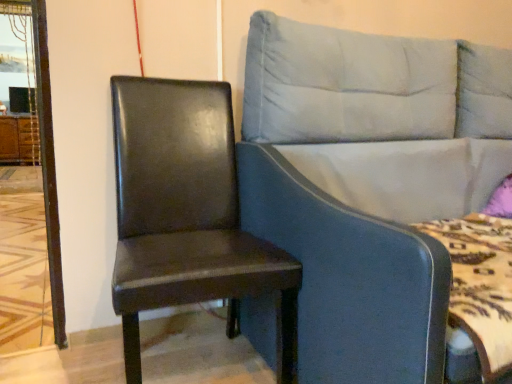
Question: Is brown wood dresser at left placed right next to light blue fabric studio couch at center?

Choices:
 (A) no
 (B) yes

Answer: (A)

Question: Is brown wood dresser at left looking in the opposite direction of light blue fabric studio couch at center?

Choices:
 (A) no
 (B) yes

Answer: (A)

Question: Is brown wood dresser at left smaller than light blue fabric studio couch at center?

Choices:
 (A) yes
 (B) no

Answer: (A)

Question: Does brown wood dresser at left lie in front of light blue fabric studio couch at center?

Choices:
 (A) no
 (B) yes

Answer: (A)

Question: Is brown wood dresser at left positioned behind light blue fabric studio couch at center?

Choices:
 (A) yes
 (B) no

Answer: (A)

Question: Is light blue fabric studio couch at center bigger or smaller than brown wood dresser at left?

Choices:
 (A) small
 (B) big

Answer: (B)

Question: From a real-world perspective, is light blue fabric studio couch at center positioned above or below brown wood dresser at left?

Choices:
 (A) below
 (B) above

Answer: (B)

Question: In the image, is light blue fabric studio couch at center on the left side or the right side of brown wood dresser at left?

Choices:
 (A) right
 (B) left

Answer: (A)

Question: Considering the positions of light blue fabric studio couch at center and brown wood dresser at left in the image, is light blue fabric studio couch at center taller or shorter than brown wood dresser at left?

Choices:
 (A) short
 (B) tall

Answer: (B)

Question: From the image's perspective, is matte black chair at left above or below brown wood dresser at left?

Choices:
 (A) above
 (B) below

Answer: (B)

Question: Considering the positions of point (212, 248) and point (37, 145), is point (212, 248) closer or farther from the camera than point (37, 145)?

Choices:
 (A) closer
 (B) farther

Answer: (A)

Question: From their relative heights in the image, would you say matte black chair at left is taller or shorter than brown wood dresser at left?

Choices:
 (A) short
 (B) tall

Answer: (B)

Question: Is matte black chair at left inside the boundaries of brown wood dresser at left, or outside?

Choices:
 (A) inside
 (B) outside

Answer: (B)

Question: Choose the correct answer: Is light blue fabric studio couch at center inside matte black chair at left or outside it?

Choices:
 (A) outside
 (B) inside

Answer: (A)

Question: From the image's perspective, relative to matte black chair at left, is light blue fabric studio couch at center above or below?

Choices:
 (A) below
 (B) above

Answer: (B)